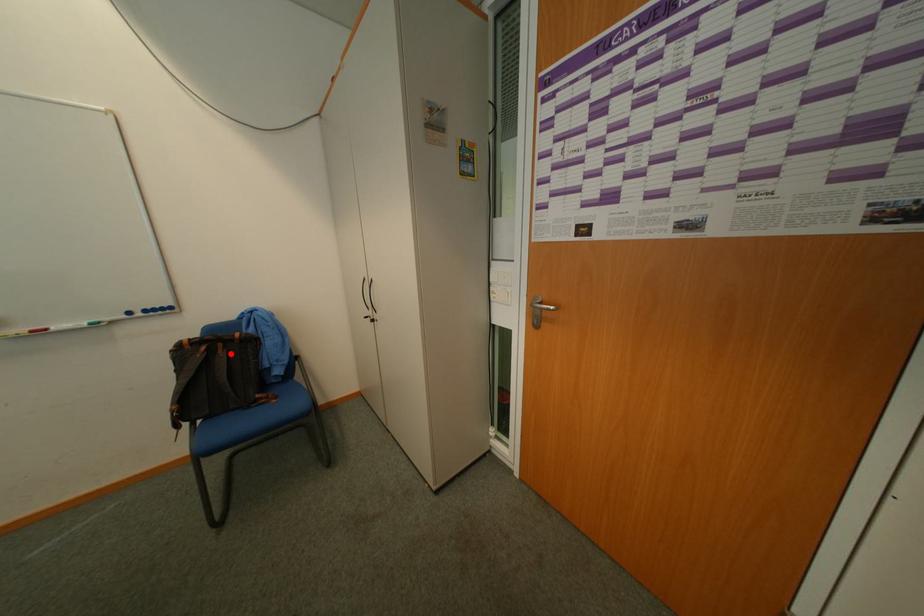
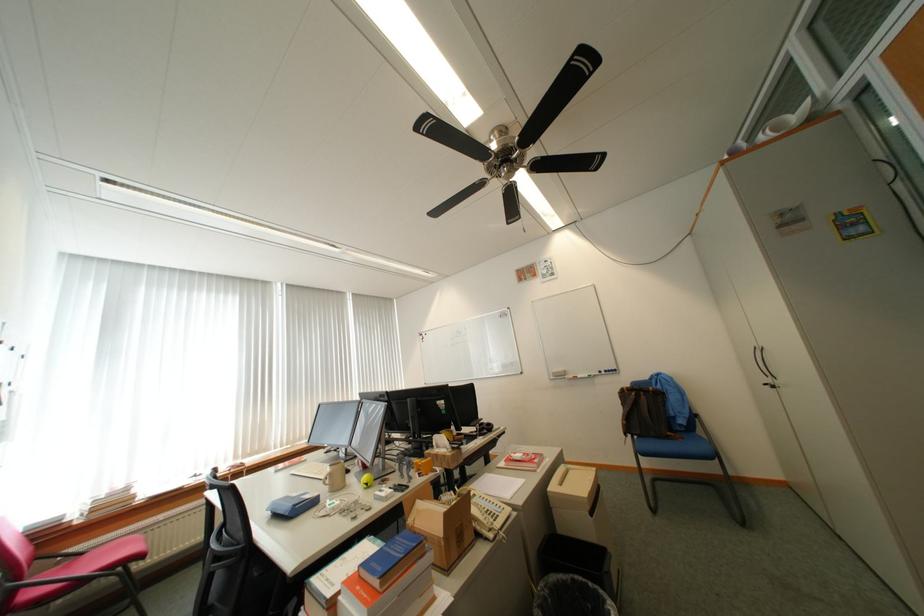
Question: I am providing you with two images of the same scene from different viewpoints. A red point is marked on the first image. At the location where the point appears in image 1, is it still visible in image 2?

Choices:
 (A) Yes
 (B) No

Answer: (A)